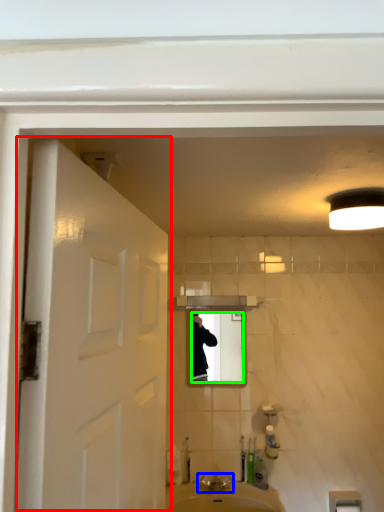
Question: Based on their relative distances, which object is nearer to door (highlighted by a red box)? Choose from tap (highlighted by a blue box) and mirror (highlighted by a green box).

Choices:
 (A) tap
 (B) mirror

Answer: (B)